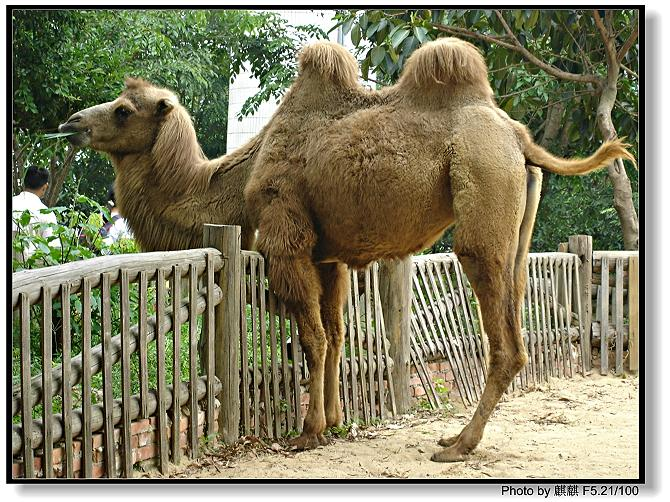
Locate an element on the screen. The image size is (670, 502). the right front leg is located at coordinates (336, 301).